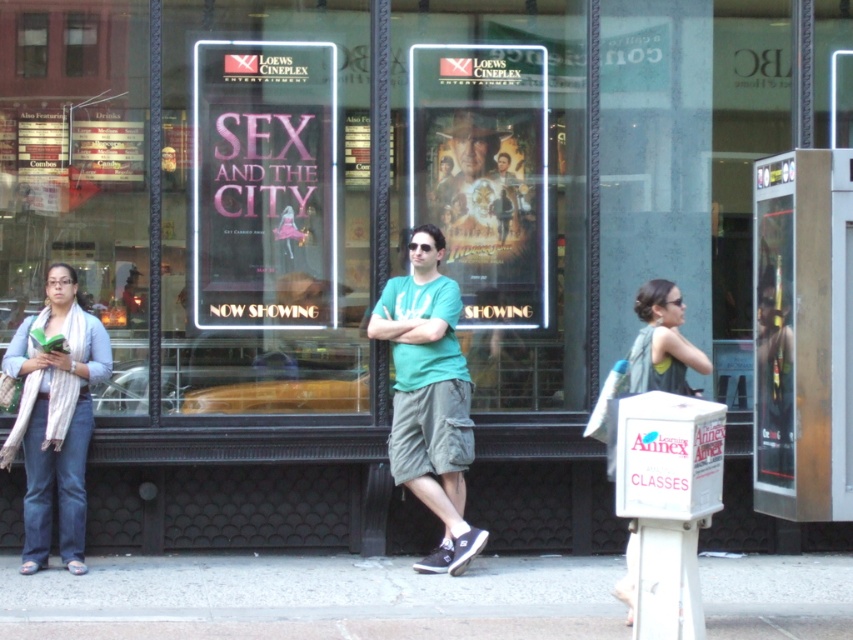
Question: Is gray concrete pavement at lower center further to the viewer compared to green fabric tank top at center?

Choices:
 (A) yes
 (B) no

Answer: (B)

Question: Which object appears farthest from the camera in this image?

Choices:
 (A) green cotton t-shirt at center
 (B) denim jacket at lower left

Answer: (A)

Question: Does denim jacket at lower left appear under green fabric tank top at center?

Choices:
 (A) no
 (B) yes

Answer: (B)

Question: Which point appears closest to the camera in this image?

Choices:
 (A) (666, 349)
 (B) (42, 328)

Answer: (A)

Question: Does green cotton t-shirt at center have a larger size compared to denim jacket at lower left?

Choices:
 (A) yes
 (B) no

Answer: (A)

Question: Which point appears closest to the camera in this image?

Choices:
 (A) (399, 342)
 (B) (114, 566)
 (C) (90, 397)

Answer: (C)